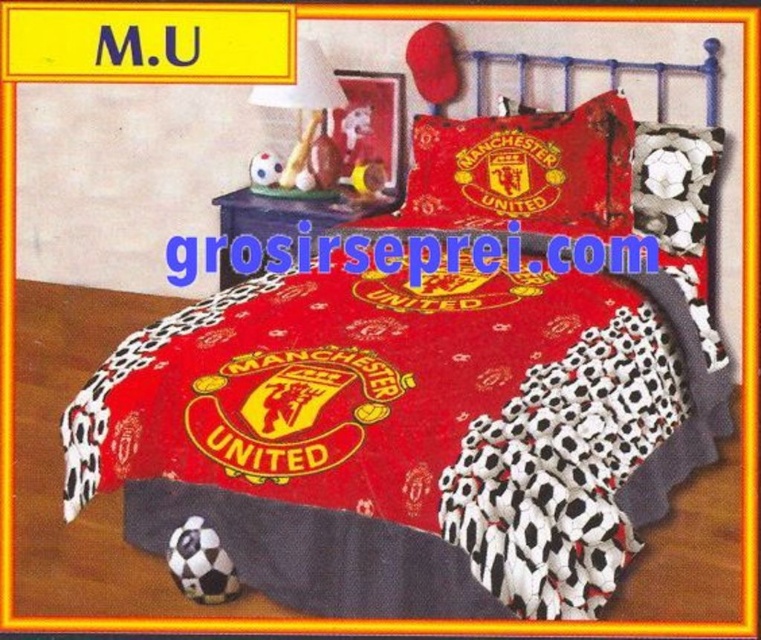
Question: Does soccer-patterned fabric pillow at upper center have a larger size compared to matte white lamp at upper center?

Choices:
 (A) yes
 (B) no

Answer: (B)

Question: Is soccer-patterned fabric pillow at upper center behind matte white lamp at upper center?

Choices:
 (A) yes
 (B) no

Answer: (B)

Question: Which of these objects is positioned closest to the red fabric manchester united logo pillow at center?

Choices:
 (A) soccer-patterned fabric pillow at upper center
 (B) matte white lamp at upper center
 (C) soccer ball at center

Answer: (A)

Question: Which of the following is the farthest from the observer?

Choices:
 (A) (253, 182)
 (B) (514, 138)
 (C) (670, 234)

Answer: (A)

Question: Which point is closer to the camera?

Choices:
 (A) matte white lamp at upper center
 (B) soccer-patterned fabric pillow at upper center
 (C) red fabric manchester united logo pillow at center

Answer: (C)

Question: Can you confirm if matte white lamp at upper center is positioned above soccer ball at center?

Choices:
 (A) yes
 (B) no

Answer: (A)